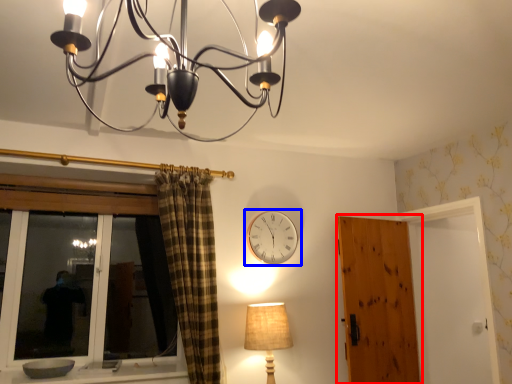
Question: Which point is further to the camera, door (highlighted by a red box) or wall clock (highlighted by a blue box)?

Choices:
 (A) door
 (B) wall clock

Answer: (B)